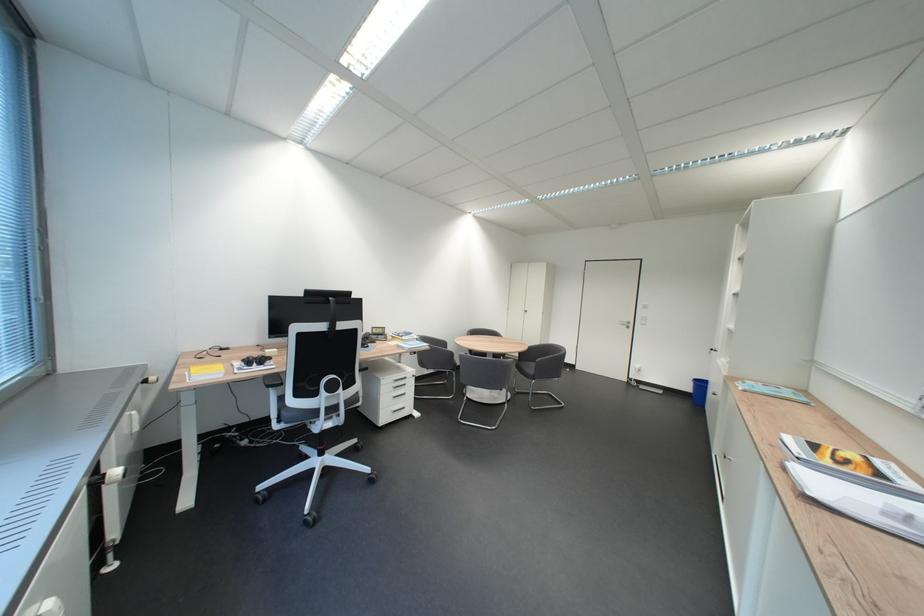
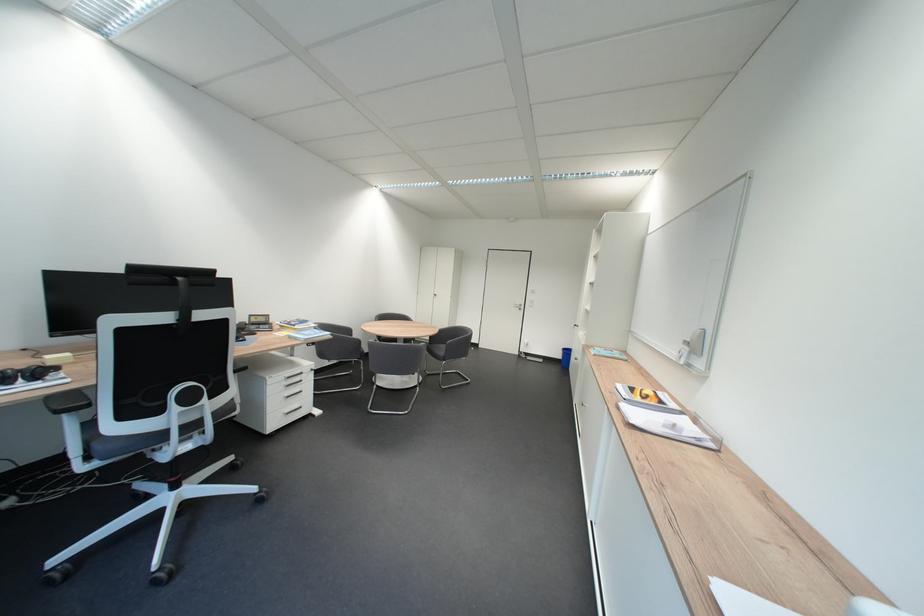
The point at (699, 387) is marked in the first image. Where is the corresponding point in the second image?

(570, 357)